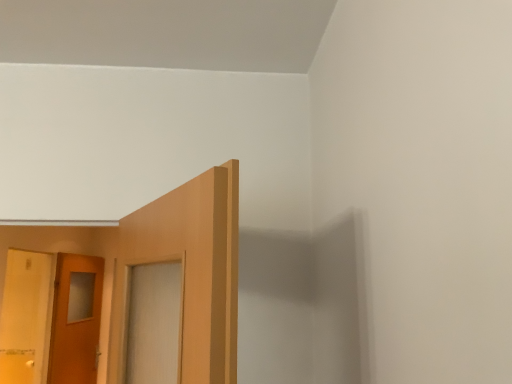
Identify the location of matte wooden door at left, which is counted as the second door, starting from the front. (76, 320).

What do you see at coordinates (76, 320) in the screenshot?
I see `matte wooden door at left, the 1th door from the back` at bounding box center [76, 320].

Measure the distance between matte wooden door at left, the 1th door from the back, and camera.

A distance of 3.41 meters exists between matte wooden door at left, the 1th door from the back, and camera.

This screenshot has height=384, width=512. In order to click on matte wooden door at left, the 2th door in the back-to-front sequence in this screenshot , I will do `click(25, 317)`.

The height and width of the screenshot is (384, 512). What do you see at coordinates (25, 317) in the screenshot? I see `matte wooden door at left, the 2th door in the back-to-front sequence` at bounding box center [25, 317].

Image resolution: width=512 pixels, height=384 pixels. I want to click on matte wooden door at left, which is counted as the second door, starting from the front, so click(76, 320).

Based on their positions, is matte wooden door at left, which is counted as the second door, starting from the front, located to the left or right of matte wooden door at left, the 2th door in the back-to-front sequence?

From the image, it's evident that matte wooden door at left, which is counted as the second door, starting from the front, is to the right of matte wooden door at left, the 2th door in the back-to-front sequence.

Which object is closer to the camera taking this photo, matte wooden door at left, which is counted as the second door, starting from the front, or matte wooden door at left, positioned as the 1th door in front-to-back order?

matte wooden door at left, positioned as the 1th door in front-to-back order.

Is point (100, 306) positioned behind point (29, 339)?

No, (100, 306) is closer to viewer.

From the image's perspective, which is above, matte wooden door at left, the 1th door from the back, or matte wooden door at left, the 2th door in the back-to-front sequence?

matte wooden door at left, the 2th door in the back-to-front sequence, is shown above in the image.

From a real-world perspective, which object stands above the other?

matte wooden door at left, positioned as the 1th door in front-to-back order, from a real-world perspective.

Between matte wooden door at left, which is counted as the second door, starting from the front, and matte wooden door at left, positioned as the 1th door in front-to-back order, which one has smaller width?

matte wooden door at left, which is counted as the second door, starting from the front.

Which of these two, matte wooden door at left, the 1th door from the back, or matte wooden door at left, positioned as the 1th door in front-to-back order, stands taller?

With more height is matte wooden door at left, the 1th door from the back.

Is matte wooden door at left, the 1th door from the back, bigger than matte wooden door at left, the 2th door in the back-to-front sequence?

Actually, matte wooden door at left, the 1th door from the back, might be smaller than matte wooden door at left, the 2th door in the back-to-front sequence.

Is matte wooden door at left, the 1th door from the back, situated inside matte wooden door at left, the 2th door in the back-to-front sequence, or outside?

matte wooden door at left, the 1th door from the back, is outside matte wooden door at left, the 2th door in the back-to-front sequence.

Consider the image. Can you see matte wooden door at left, which is counted as the second door, starting from the front, touching matte wooden door at left, the 2th door in the back-to-front sequence?

No, matte wooden door at left, which is counted as the second door, starting from the front, is not in contact with matte wooden door at left, the 2th door in the back-to-front sequence.

Could you tell me if matte wooden door at left, the 1th door from the back, is facing matte wooden door at left, the 2th door in the back-to-front sequence?

No, matte wooden door at left, the 1th door from the back, is not turned towards matte wooden door at left, the 2th door in the back-to-front sequence.

What's the angular difference between matte wooden door at left, the 1th door from the back, and matte wooden door at left, the 2th door in the back-to-front sequence,'s facing directions?

There is a 9.08-degree angle between the facing directions of matte wooden door at left, the 1th door from the back, and matte wooden door at left, the 2th door in the back-to-front sequence.

In order to click on door above the matte wooden door at left, which is counted as the second door, starting from the front (from a real-world perspective) in this screenshot , I will do `click(25, 317)`.

Based on their positions, is matte wooden door at left, positioned as the 1th door in front-to-back order, located to the left or right of matte wooden door at left, which is counted as the second door, starting from the front?

Clearly, matte wooden door at left, positioned as the 1th door in front-to-back order, is on the left of matte wooden door at left, which is counted as the second door, starting from the front, in the image.

Which is behind, matte wooden door at left, positioned as the 1th door in front-to-back order, or matte wooden door at left, which is counted as the second door, starting from the front?

matte wooden door at left, which is counted as the second door, starting from the front, is behind.

Between point (23, 353) and point (68, 272), which one is positioned behind?

The point (23, 353) is farther.

From the image's perspective, which one is positioned higher, matte wooden door at left, positioned as the 1th door in front-to-back order, or matte wooden door at left, which is counted as the second door, starting from the front?

matte wooden door at left, positioned as the 1th door in front-to-back order, appears higher in the image.

From a real-world perspective, is matte wooden door at left, the 2th door in the back-to-front sequence, positioned over matte wooden door at left, the 1th door from the back, based on gravity?

Yes, from a real-world perspective, matte wooden door at left, the 2th door in the back-to-front sequence, is on top of matte wooden door at left, the 1th door from the back.

Considering the sizes of objects matte wooden door at left, positioned as the 1th door in front-to-back order, and matte wooden door at left, the 1th door from the back, in the image provided, who is thinner, matte wooden door at left, positioned as the 1th door in front-to-back order, or matte wooden door at left, the 1th door from the back,?

matte wooden door at left, the 1th door from the back.

From the picture: Who is taller, matte wooden door at left, positioned as the 1th door in front-to-back order, or matte wooden door at left, the 1th door from the back?

Standing taller between the two is matte wooden door at left, the 1th door from the back.

Is matte wooden door at left, the 2th door in the back-to-front sequence, bigger than matte wooden door at left, the 1th door from the back?

Indeed, matte wooden door at left, the 2th door in the back-to-front sequence, has a larger size compared to matte wooden door at left, the 1th door from the back.

Is matte wooden door at left, positioned as the 1th door in front-to-back order, outside of matte wooden door at left, which is counted as the second door, starting from the front?

matte wooden door at left, positioned as the 1th door in front-to-back order, lies outside matte wooden door at left, which is counted as the second door, starting from the front,'s area.

Is matte wooden door at left, positioned as the 1th door in front-to-back order, beside matte wooden door at left, which is counted as the second door, starting from the front?

There is a gap between matte wooden door at left, positioned as the 1th door in front-to-back order, and matte wooden door at left, which is counted as the second door, starting from the front.

Looking at this image, is matte wooden door at left, positioned as the 1th door in front-to-back order, looking in the opposite direction of matte wooden door at left, the 1th door from the back?

No, matte wooden door at left, positioned as the 1th door in front-to-back order,'s orientation is not away from matte wooden door at left, the 1th door from the back.

Consider the image. How different are the orientations of matte wooden door at left, positioned as the 1th door in front-to-back order, and matte wooden door at left, which is counted as the second door, starting from the front, in degrees?

matte wooden door at left, positioned as the 1th door in front-to-back order, and matte wooden door at left, which is counted as the second door, starting from the front, are facing 9.08 degrees away from each other.

This screenshot has height=384, width=512. I want to click on door on the left of matte wooden door at left, which is counted as the second door, starting from the front, so click(x=25, y=317).

Image resolution: width=512 pixels, height=384 pixels. I want to click on door to the left of matte wooden door at left, the 1th door from the back, so click(25, 317).

Find the location of a particular element. The width and height of the screenshot is (512, 384). door above the matte wooden door at left, which is counted as the second door, starting from the front (from a real-world perspective) is located at coordinates (25, 317).